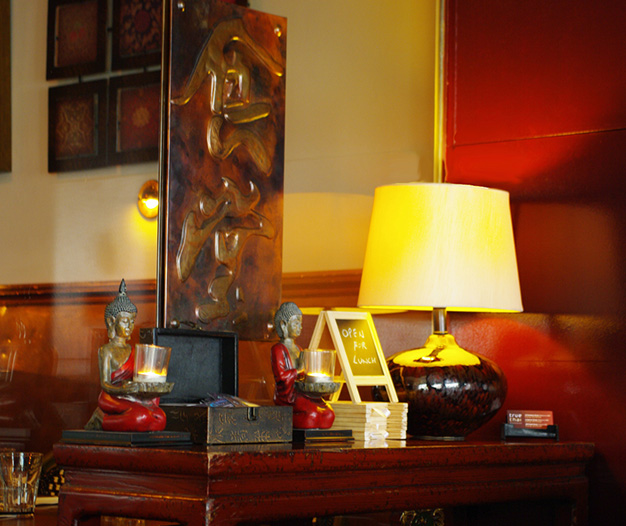
Find the location of a particular element. This screenshot has height=526, width=626. box lid is located at coordinates (193, 352).